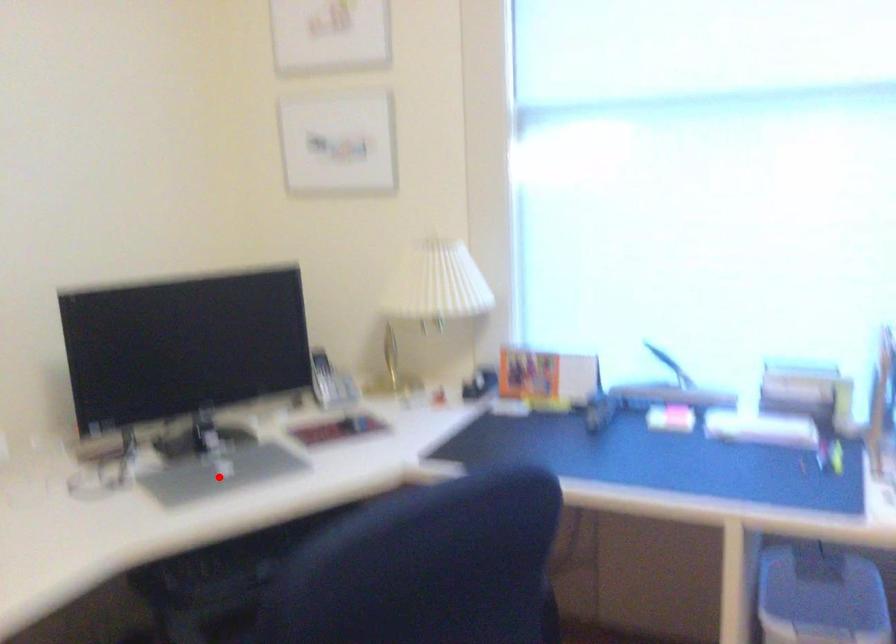
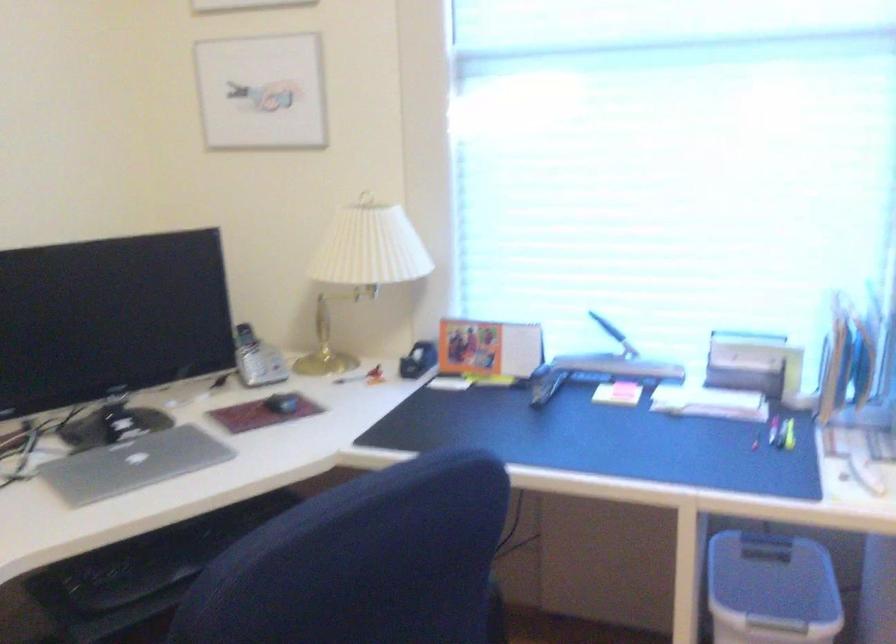
In the second image, find the point that corresponds to the highlighted location in the first image.

(133, 464)